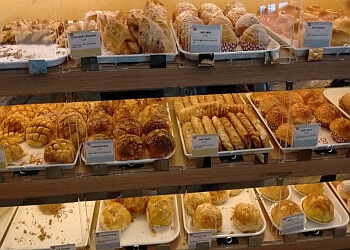
The width and height of the screenshot is (350, 250). I want to click on glare coming from light source, so click(272, 10).